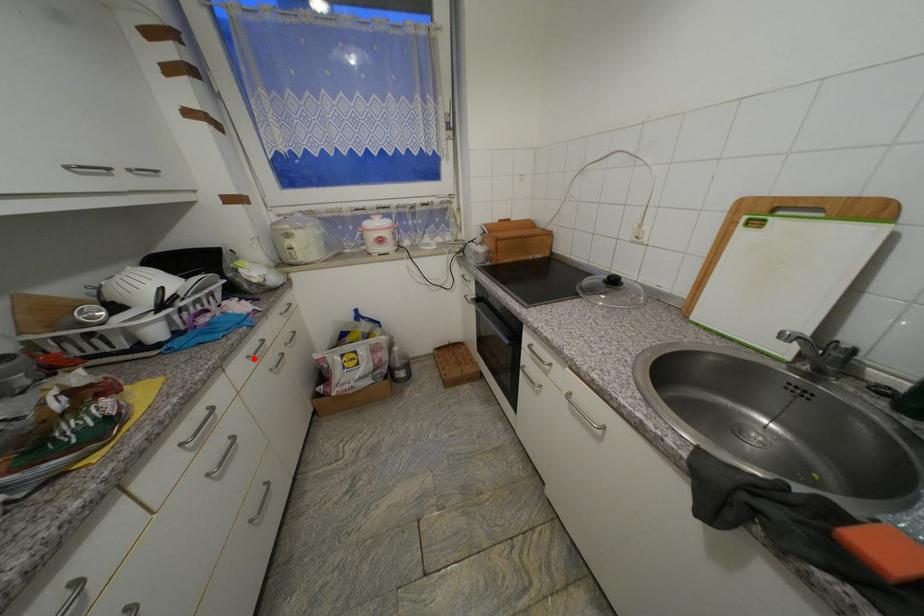
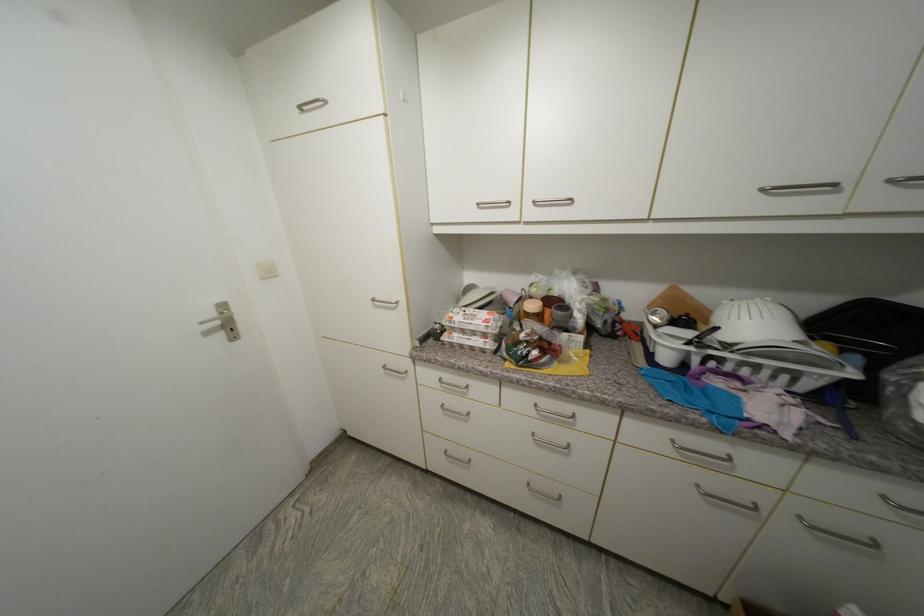
Question: I am providing you with two images of the same scene from different viewpoints. Given a red point in image1, look at the same physical point in image2. Is it:

Choices:
 (A) Closer to the viewpoint
 (B) Farther from the viewpoint

Answer: (B)